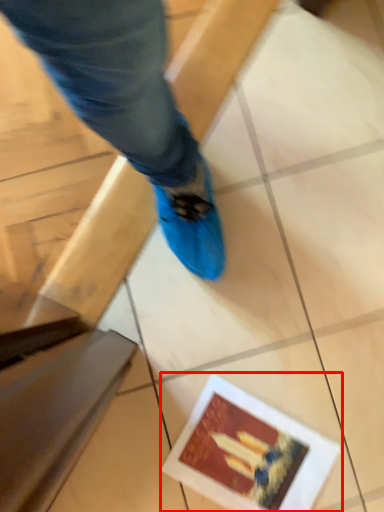
Question: From the image, what is the correct spatial relationship of postcard (annotated by the red box) in relation to tile?

Choices:
 (A) right
 (B) left

Answer: (A)